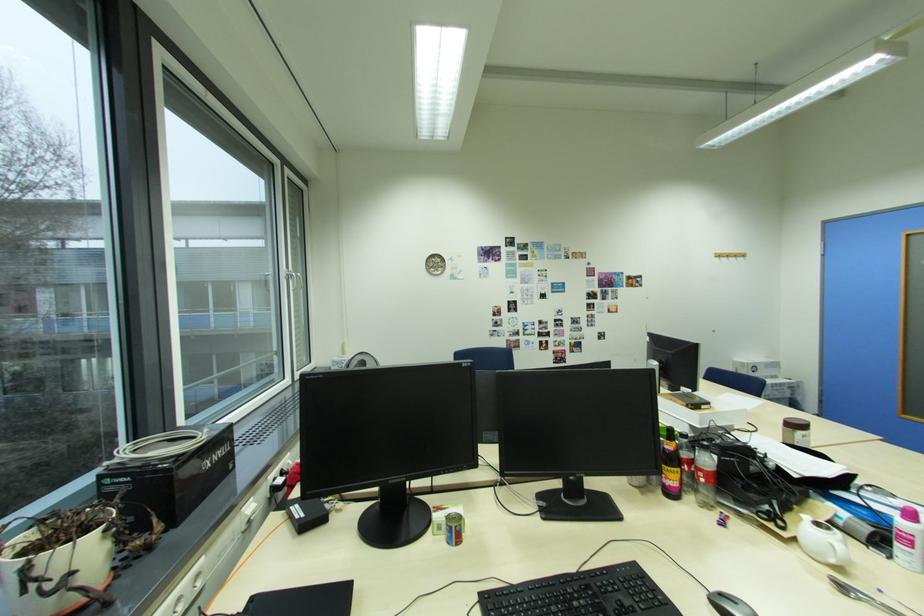
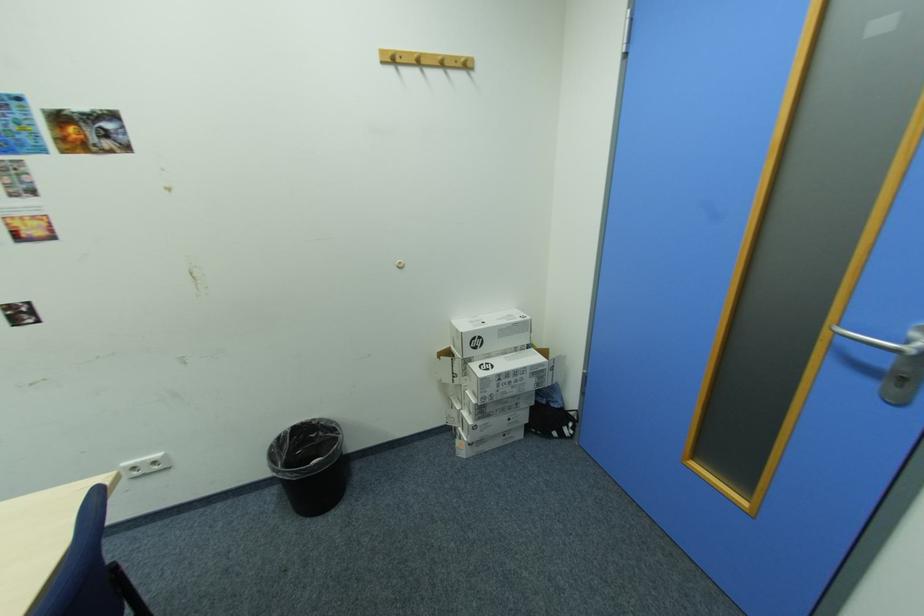
The point at (749, 363) is marked in the first image. Where is the corresponding point in the second image?

(465, 331)